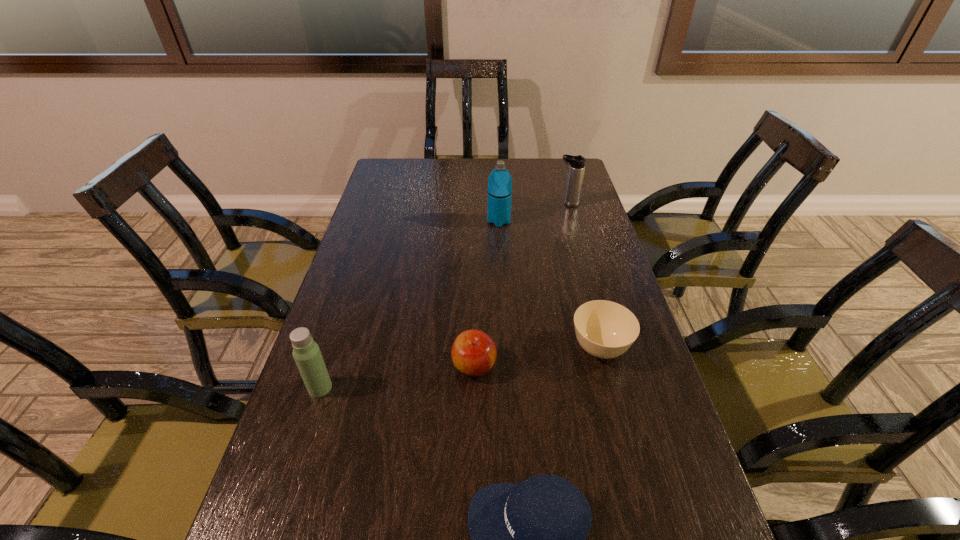
You are a GUI agent. You are given a task and a screenshot of the screen. Output one action in this format:
    pyautogui.click(x=<x>, y=<y>)
    Task: Click on the free point at the right edge
    Image resolution: width=960 pixels, height=540 pixels.
    Given the screenshot: What is the action you would take?
    pyautogui.click(x=578, y=295)

The image size is (960, 540). In order to click on free space at the far left corner of the desktop in this screenshot , I will do `click(412, 167)`.

Where is `vacant space at the far right corner of the desktop`? This screenshot has height=540, width=960. vacant space at the far right corner of the desktop is located at coordinates (562, 164).

This screenshot has width=960, height=540. In order to click on vacant space in between the rightmost thermos bottle and the nearest thermos bottle in this screenshot , I will do [444, 296].

The height and width of the screenshot is (540, 960). I want to click on empty location between the nearest thermos bottle and the tallest object, so click(409, 305).

The width and height of the screenshot is (960, 540). Identify the location of free point between the apple and the leftmost object. (397, 377).

Identify the location of unoccupied area between the tallest thermos bottle and the leftmost object. The height and width of the screenshot is (540, 960). (409, 305).

The image size is (960, 540). In order to click on vacant point located between the farthest thermos bottle and the apple in this screenshot , I will do click(x=521, y=285).

This screenshot has width=960, height=540. What are the coordinates of `blank region between the apple and the second farthest object` in the screenshot? It's located at (487, 294).

Locate an element on the screen. Image resolution: width=960 pixels, height=540 pixels. blank region between the apple and the sugar bowl is located at coordinates pos(537,357).